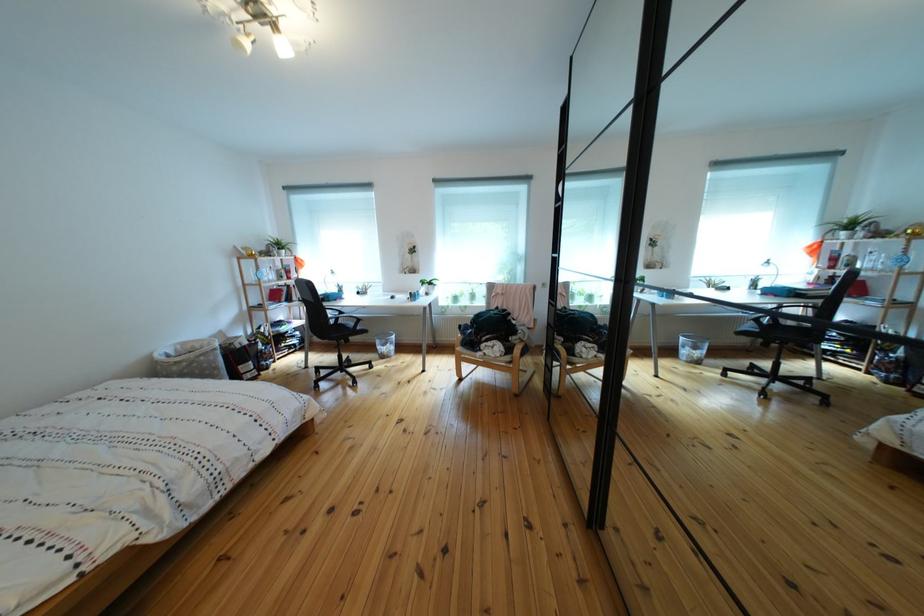
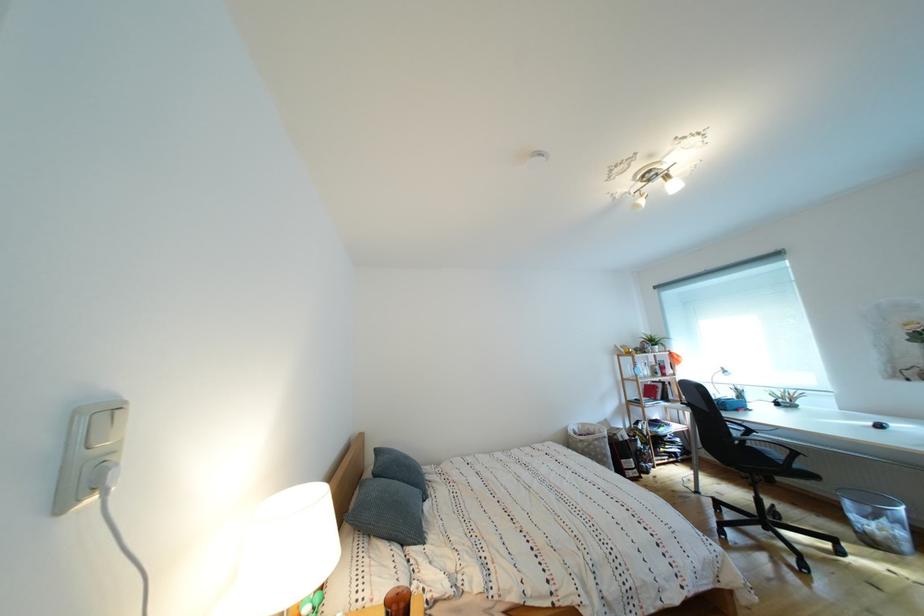
Find the pixel in the second image that matches (x=347, y=325) in the first image.

(756, 446)